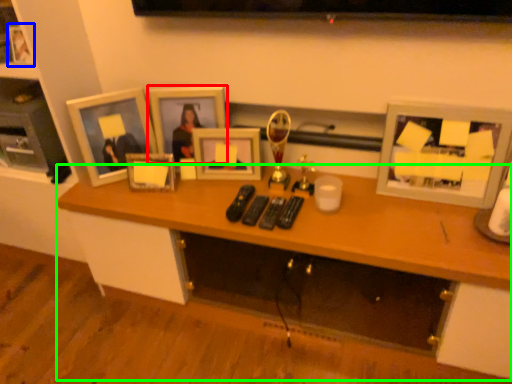
Question: Based on their relative distances, which object is nearer to picture frame (highlighted by a red box)? Choose from picture frame (highlighted by a blue box) and desk (highlighted by a green box).

Choices:
 (A) picture frame
 (B) desk

Answer: (B)